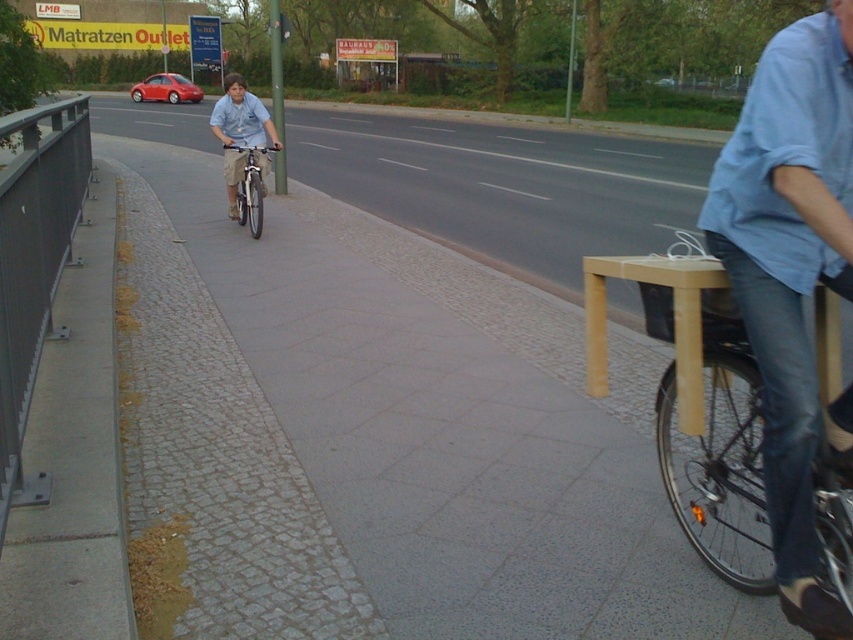
Question: Can you confirm if blue denim jeans at center is thinner than light blue shirt at center?

Choices:
 (A) yes
 (B) no

Answer: (B)

Question: Which point is closer to the camera taking this photo?

Choices:
 (A) (837, 234)
 (B) (241, 177)
 (C) (247, 205)
 (D) (49, 109)

Answer: (A)

Question: Is dark gray metal rail at left positioned at the back of light blue shirt at center?

Choices:
 (A) yes
 (B) no

Answer: (B)

Question: Which is nearer to the blue denim jeans at center?

Choices:
 (A) light blue shirt at center
 (B) dark gray metal rail at left
 (C) silver metallic bicycle at center-left

Answer: (B)

Question: Which point is closer to the camera?

Choices:
 (A) (253, 224)
 (B) (234, 147)

Answer: (B)

Question: Can you confirm if light blue shirt at center is smaller than silver metallic bicycle at center-left?

Choices:
 (A) no
 (B) yes

Answer: (A)